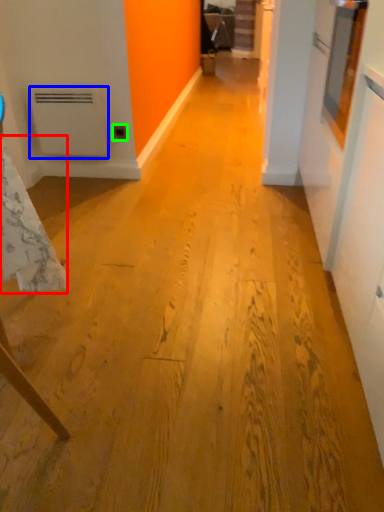
Question: Considering the real-world distances, which object is closest to tablecloth (highlighted by a red box)? water heater (highlighted by a blue box) or electric outlet (highlighted by a green box).

Choices:
 (A) water heater
 (B) electric outlet

Answer: (A)